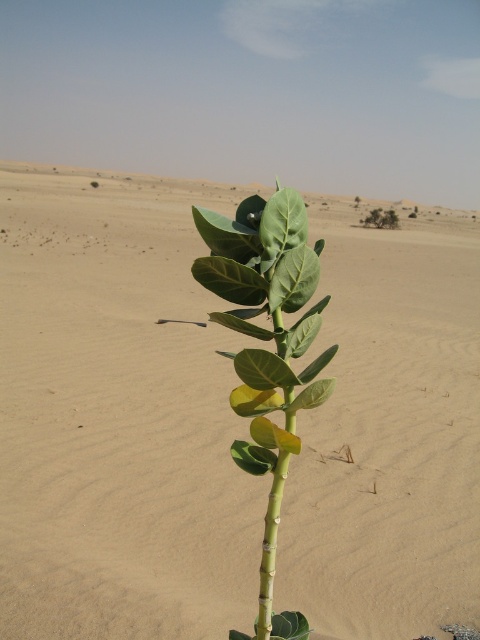
Can you confirm if sandy beige sand at center is shorter than green matte leaf at upper center?

No.

Between point (62, 614) and point (374, 221), which one is positioned behind?

The point (374, 221) is behind.

Locate an element on the screen. The image size is (480, 640). sandy beige sand at center is located at coordinates (117, 417).

In the scene shown: Can you confirm if green matte leafy plant at center is bigger than green matte leaf at center?

Indeed, green matte leafy plant at center has a larger size compared to green matte leaf at center.

The image size is (480, 640). Identify the location of green matte leafy plant at center. pos(267,349).

Where is `green matte leafy plant at center`? green matte leafy plant at center is located at coordinates (267, 349).

Between green matte leafy plant at center and green matte leaf at upper center, which one is positioned lower?

green matte leafy plant at center is lower down.

Which is in front, point (280, 260) or point (396, 220)?

Positioned in front is point (280, 260).

The height and width of the screenshot is (640, 480). What are the coordinates of `green matte leafy plant at center` in the screenshot? It's located at (267, 349).